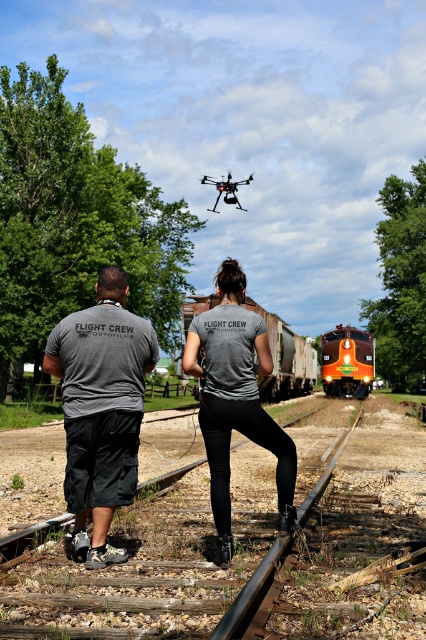
Question: Is gray matte shirt at center wider than orange freight train at center?

Choices:
 (A) yes
 (B) no

Answer: (B)

Question: Which point is closer to the camera taking this photo?

Choices:
 (A) (111, 492)
 (B) (213, 499)
 (C) (227, 202)
 (D) (281, 381)

Answer: (A)

Question: Is gray matte shirt at center positioned at the back of maroon glossy train at center?

Choices:
 (A) no
 (B) yes

Answer: (A)

Question: Which is farther from the maroon glossy train at center?

Choices:
 (A) black matte drone at center
 (B) gray fabric flight crew shirts at center
 (C) gray fabric shirt at center

Answer: (C)

Question: Among these points, which one is nearest to the camera?

Choices:
 (A) (219, 182)
 (B) (198, 296)
 (C) (213, 513)

Answer: (C)

Question: In this image, where is gray fabric flight crew shirts at center located relative to gray fabric shirt at center?

Choices:
 (A) below
 (B) above

Answer: (B)